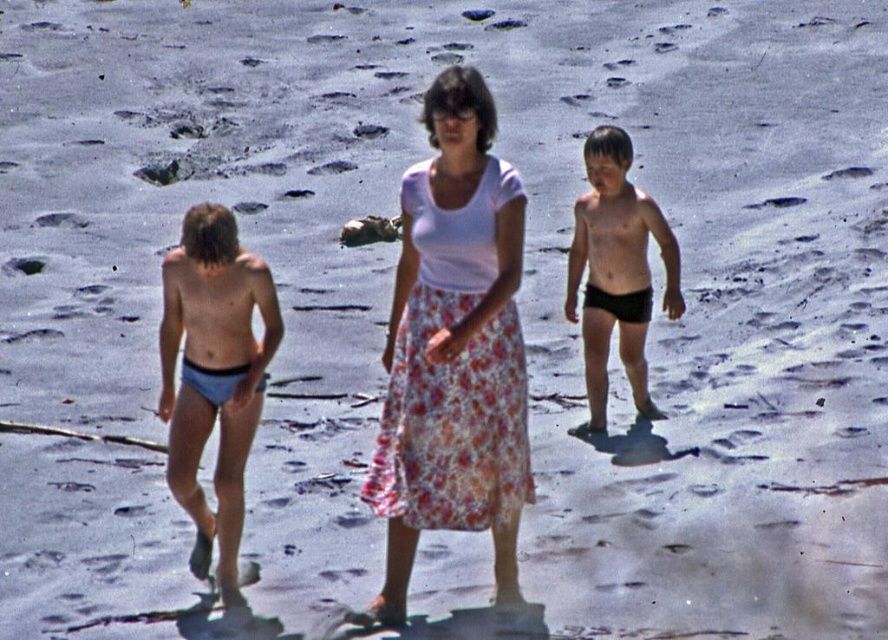
Which is more to the right, white floral skirt at center or black matte shorts at right?

black matte shorts at right is more to the right.

Is point (413, 372) positioned after point (611, 202)?

No.

Identify the location of white floral skirt at center. The height and width of the screenshot is (640, 888). (453, 348).

Find the location of a particular element. white floral skirt at center is located at coordinates (453, 348).

Who is taller, light blue fabric shorts at left or black matte shorts at right?

black matte shorts at right is taller.

Who is positioned more to the right, light blue fabric shorts at left or black matte shorts at right?

From the viewer's perspective, black matte shorts at right appears more on the right side.

Which is behind, point (217, 262) or point (645, 404)?

The point (645, 404) is behind.

At what (x,y) coordinates should I click in order to perform the action: click on light blue fabric shorts at left. Please return your answer as a coordinate pair (x, y). Looking at the image, I should click on (213, 372).

From the picture: Does white floral skirt at center have a larger size compared to light blue fabric shorts at left?

Correct, white floral skirt at center is larger in size than light blue fabric shorts at left.

Is white floral skirt at center to the right of light blue fabric shorts at left from the viewer's perspective?

Yes, white floral skirt at center is to the right of light blue fabric shorts at left.

Describe the element at coordinates (453, 348) in the screenshot. I see `white floral skirt at center` at that location.

You are a GUI agent. You are given a task and a screenshot of the screen. Output one action in this format:
    pyautogui.click(x=<x>, y=<y>)
    Task: Click on the white floral skirt at center
    This screenshot has height=640, width=888.
    Given the screenshot: What is the action you would take?
    453,348